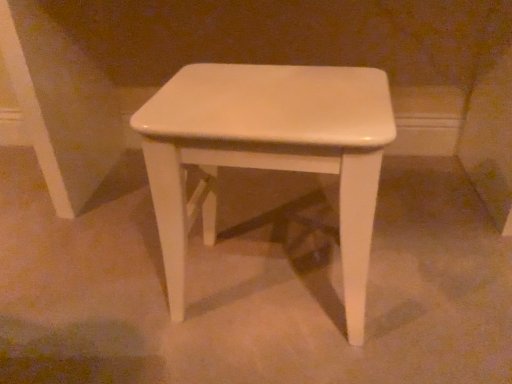
Locate an element on the screen. vacant point above white glossy stool at center (from a real-world perspective) is located at coordinates (245, 88).